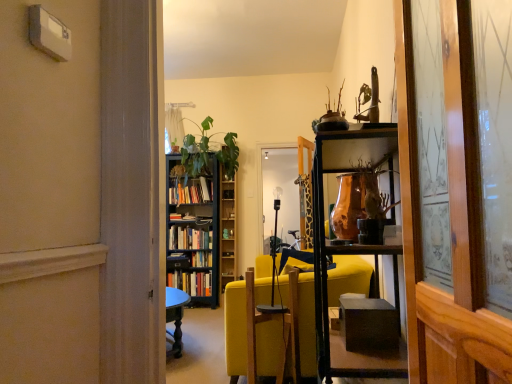
Question: Is green matte bookshelf at center smaller than hardcover books at center, which is counted as the third book, starting from the top?

Choices:
 (A) no
 (B) yes

Answer: (A)

Question: Can you confirm if green matte bookshelf at center is bigger than hardcover books at center, the first book from the bottom?

Choices:
 (A) yes
 (B) no

Answer: (A)

Question: Is green matte bookshelf at center not inside hardcover books at center, which is counted as the third book, starting from the top?

Choices:
 (A) yes
 (B) no

Answer: (A)

Question: Would you say hardcover books at center, the first book from the bottom, is part of green matte bookshelf at center's contents?

Choices:
 (A) yes
 (B) no

Answer: (B)

Question: From the image's perspective, is green matte bookshelf at center beneath hardcover books at center, which is counted as the third book, starting from the top?

Choices:
 (A) no
 (B) yes

Answer: (A)

Question: Is green matte bookshelf at center shorter than hardcover books at center, the first book from the bottom?

Choices:
 (A) yes
 (B) no

Answer: (B)

Question: From a real-world perspective, is hardcover books at center, which is counted as the third book, starting from the top, physically below hardcover books at center, marked as the first book in a top-to-bottom arrangement?

Choices:
 (A) yes
 (B) no

Answer: (A)

Question: Is hardcover books at center, which is counted as the third book, starting from the top, to the left of hardcover books at center, which is the 3th book from bottom to top, from the viewer's perspective?

Choices:
 (A) yes
 (B) no

Answer: (A)

Question: Considering the relative sizes of hardcover books at center, which is counted as the third book, starting from the top, and hardcover books at center, which is the 3th book from bottom to top, in the image provided, is hardcover books at center, which is counted as the third book, starting from the top, shorter than hardcover books at center, which is the 3th book from bottom to top,?

Choices:
 (A) no
 (B) yes

Answer: (B)

Question: From a real-world perspective, is hardcover books at center, which is counted as the third book, starting from the top, physically above hardcover books at center, marked as the first book in a top-to-bottom arrangement?

Choices:
 (A) no
 (B) yes

Answer: (A)

Question: Is hardcover books at center, which is counted as the third book, starting from the top, in front of hardcover books at center, marked as the first book in a top-to-bottom arrangement?

Choices:
 (A) no
 (B) yes

Answer: (B)

Question: Does hardcover books at center, the first book from the bottom, have a greater width compared to hardcover books at center, marked as the first book in a top-to-bottom arrangement?

Choices:
 (A) yes
 (B) no

Answer: (A)

Question: Is green leafy plant at center further to the viewer compared to copper metallic vase at center?

Choices:
 (A) no
 (B) yes

Answer: (B)